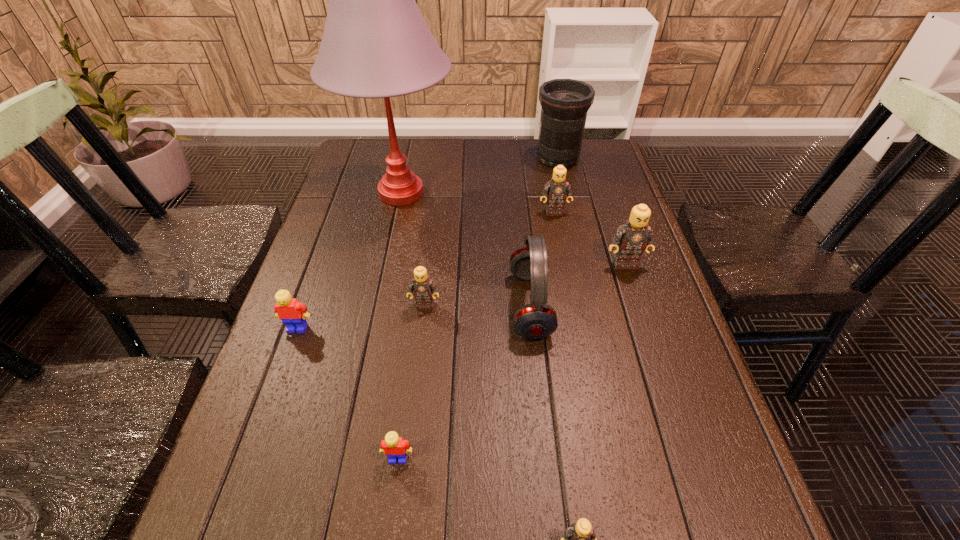
The image size is (960, 540). What are the coordinates of `light table lamp` in the screenshot? It's located at (376, 44).

Locate an element on the screen. The width and height of the screenshot is (960, 540). the tallest object is located at coordinates (376, 44).

You are a GUI agent. You are given a task and a screenshot of the screen. Output one action in this format:
    pyautogui.click(x=<x>, y=<y>)
    Task: Click on the telephoto lens
    
    Given the screenshot: What is the action you would take?
    pyautogui.click(x=565, y=102)

Where is `red earphone`? The width and height of the screenshot is (960, 540). red earphone is located at coordinates coord(537,320).

The width and height of the screenshot is (960, 540). What are the coordinates of `the sixth nearest object` in the screenshot? It's located at (635, 235).

Find the location of a particular element. the rightmost Lego is located at coordinates (635, 235).

I want to click on the third smallest tan Lego, so click(558, 190).

At what (x,y) coordinates should I click in order to perform the action: click on the farthest tan Lego. Please return your answer as a coordinate pair (x, y). Image resolution: width=960 pixels, height=540 pixels. Looking at the image, I should click on (558, 190).

Image resolution: width=960 pixels, height=540 pixels. Identify the location of the bigger yellow Lego. (292, 313).

The width and height of the screenshot is (960, 540). In order to click on the farther yellow Lego in this screenshot , I will do `click(292, 313)`.